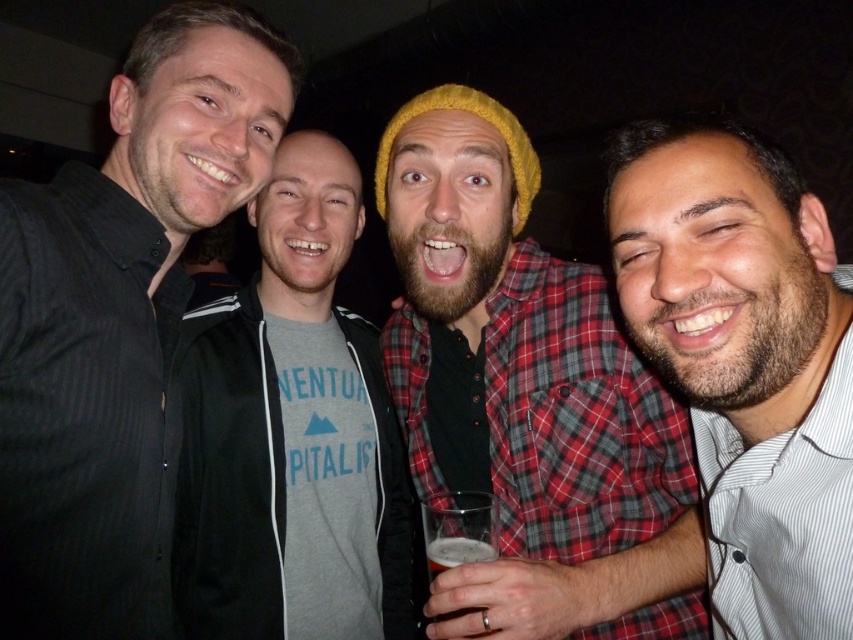
You are a photographer trying to capture a closeup of the man in the knitted yellow beanie at center and the yellow knitted hat at center. Since the camera can only focus on one object at a time, which object should you choose to ensure the other is still in the frame?

The knitted yellow beanie at center is wider than the yellow knitted hat at center. Therefore, focusing on the knitted yellow beanie at center would ensure the yellow knitted hat at center remains in the frame since it is narrower.

Based on the photo, you are standing at the point labeled point (193, 476) and want to move to the point labeled point (439, 90). Given the layout of the scene described, can you walk directly towards your destination without needing to go around any obstacles?

Since point (193, 476) is behind point (439, 90), you would need to move around point (439, 90) to reach your destination.